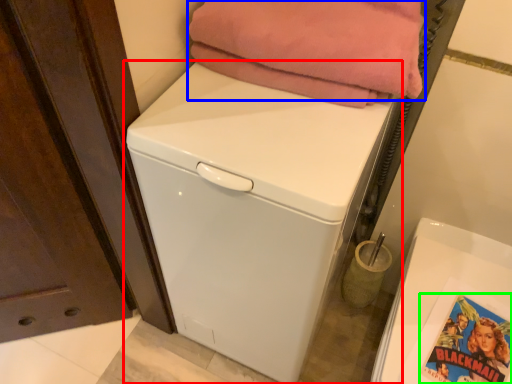
Question: Which is farther away from washing machine (highlighted by a red box)? blanket (highlighted by a blue box) or comic book (highlighted by a green box)?

Choices:
 (A) blanket
 (B) comic book

Answer: (B)